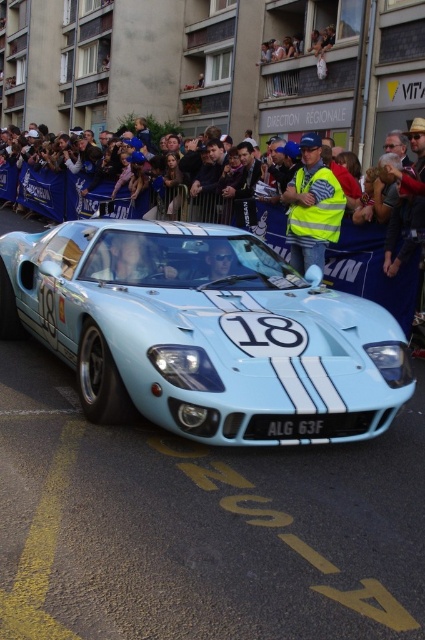
Question: Does yellow reflective vest at center come behind black plastic license plate at center?

Choices:
 (A) no
 (B) yes

Answer: (B)

Question: Does light blue metallic sports car at center have a greater width compared to black plastic license plate at center?

Choices:
 (A) yes
 (B) no

Answer: (A)

Question: Which of these objects is positioned farthest from the light blue metallic sports car at center?

Choices:
 (A) black plastic license plate at center
 (B) yellow reflective vest at center

Answer: (B)

Question: Which object appears farthest from the camera in this image?

Choices:
 (A) black plastic license plate at center
 (B) light blue metallic sports car at center

Answer: (A)

Question: Is yellow reflective vest at center in front of black plastic license plate at center?

Choices:
 (A) yes
 (B) no

Answer: (B)

Question: Considering the real-world distances, which object is closest to the yellow reflective vest at center?

Choices:
 (A) light blue metallic sports car at center
 (B) black plastic license plate at center

Answer: (A)